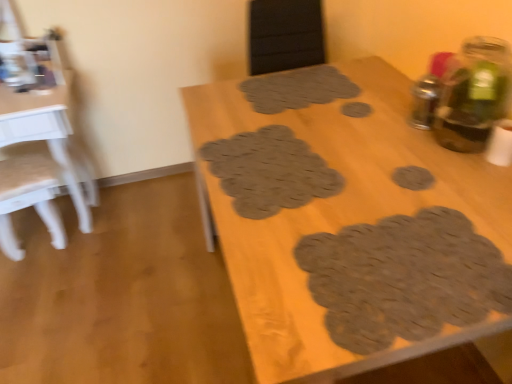
At what (x,y) coordinates should I click in order to perform the action: click on free space between green glass bottle at upper right, acting as the 1th bottle starting from the front, and brown textured coaster at center-right, the second footprint in the bottom-to-top sequence. Please return your answer as a coordinate pair (x, y). Looking at the image, I should click on click(x=435, y=164).